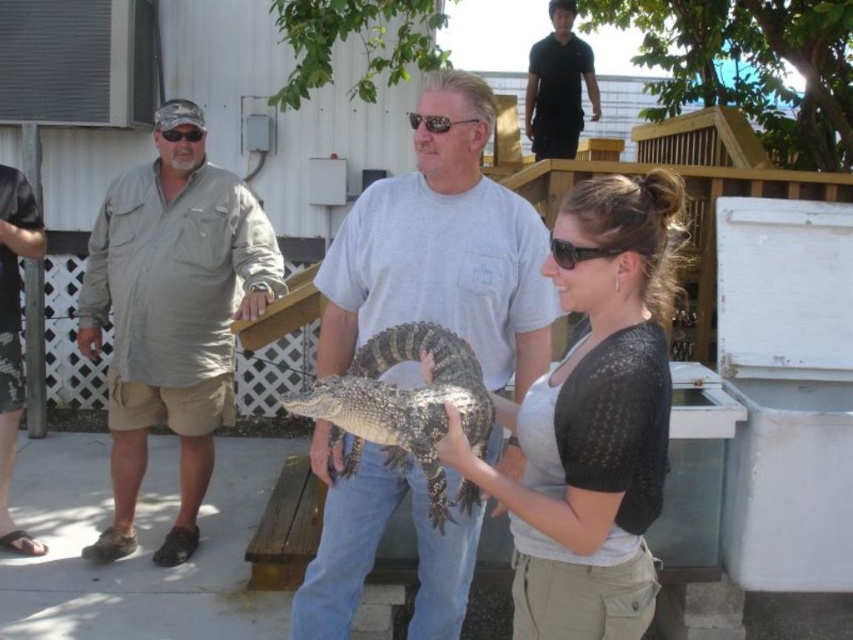
You are a fashion designer observing the outdoor scene. You notice two clothing items, the matte black sweater at center and the black smooth shirt at upper center. Which clothing item is located lower in the image?

The matte black sweater at center is positioned under the black smooth shirt at upper center, so it is located lower in the image.

In the scene shown: You are standing on the wooden deck and want to hand a small item to both the matte gray shirt at center and the brushed metal shirt at left. Which person should you approach first based on their positions?

The matte gray shirt at center is located below the brushed metal shirt at left, so you should approach the brushed metal shirt at left first as they are closer to you.

You are a photographer standing on the wooden deck. You want to take a photo of the matte gray shirt at center and the slate textured alligator at center. Based on their positions, which object will appear closer to the camera in the photo?

The matte gray shirt at center will appear closer to the camera in the photo because the slate textured alligator at center is positioned behind it.